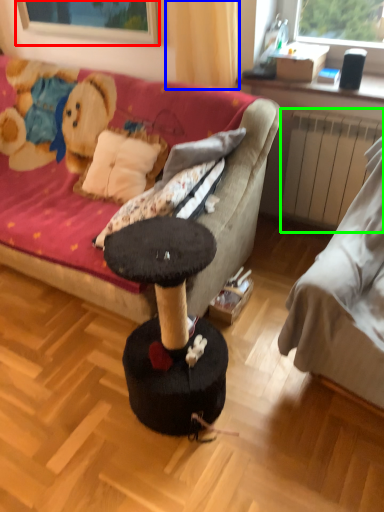
Question: Based on their relative distances, which object is nearer to window screen (highlighted by a red box)? Choose from curtain (highlighted by a blue box) and radiator (highlighted by a green box).

Choices:
 (A) curtain
 (B) radiator

Answer: (A)